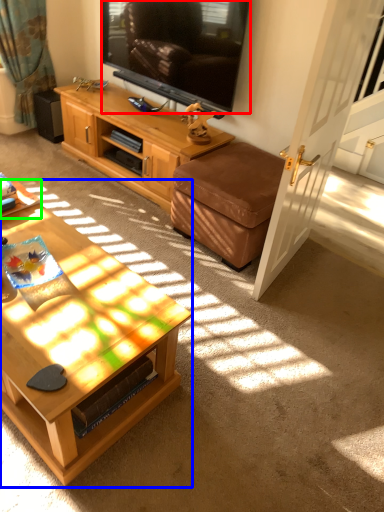
Question: Which object is the closest to the television (highlighted by a red box)? Choose among these: coffee table (highlighted by a blue box) or desk (highlighted by a green box).

Choices:
 (A) coffee table
 (B) desk

Answer: (B)